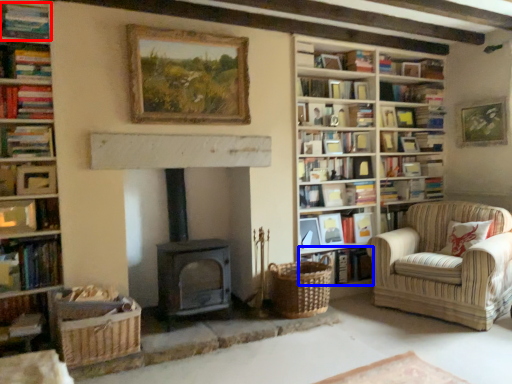
Question: Which object appears farthest to the camera in this image, book (highlighted by a red box) or book (highlighted by a blue box)?

Choices:
 (A) book
 (B) book

Answer: (B)